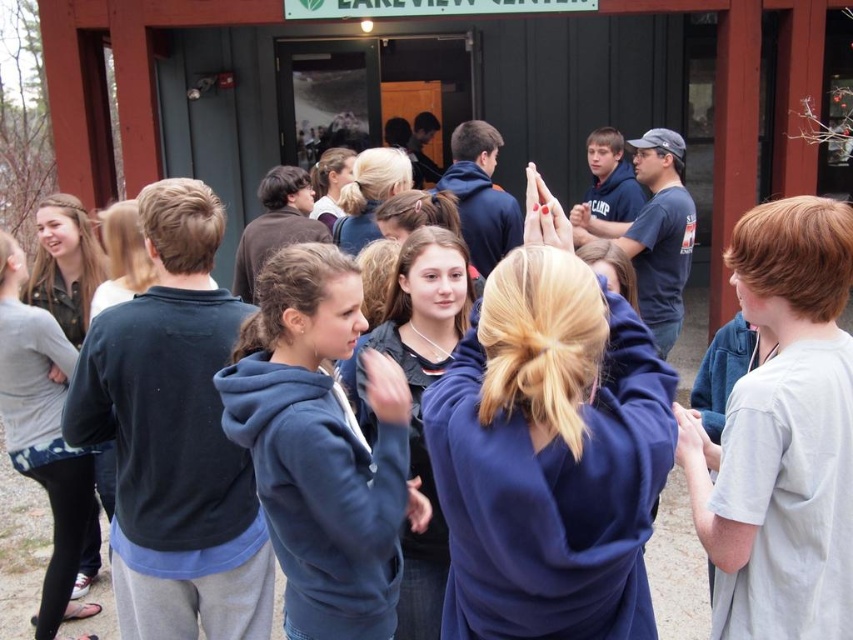
Is light gray cotton t-shirt at right shorter than blue fleece jacket at center?

In fact, light gray cotton t-shirt at right may be taller than blue fleece jacket at center.

Is light gray cotton t-shirt at right taller than blue fleece jacket at center?

Indeed, light gray cotton t-shirt at right has a greater height compared to blue fleece jacket at center.

Which is in front, point (828, 584) or point (346, 342)?

Point (828, 584) is more forward.

At what (x,y) coordinates should I click in order to perform the action: click on light gray cotton t-shirt at right. Please return your answer as a coordinate pair (x, y). The image size is (853, 640). Looking at the image, I should click on (782, 435).